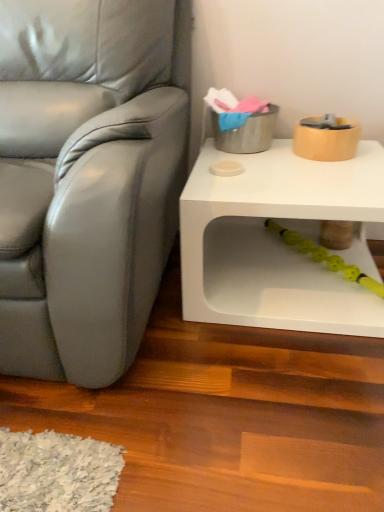
Question: Considering the positions of satin gray leather chair at left and yellow rubber toy at lower center in the image, is satin gray leather chair at left taller or shorter than yellow rubber toy at lower center?

Choices:
 (A) short
 (B) tall

Answer: (B)

Question: From a real-world perspective, relative to yellow rubber toy at lower center, is satin gray leather chair at left vertically above or below?

Choices:
 (A) above
 (B) below

Answer: (A)

Question: Estimate the real-world distances between objects in this image. Which object is farther from the white matte table at lower right?

Choices:
 (A) yellow rubber toy at lower center
 (B) satin gray leather chair at left

Answer: (B)

Question: Which object is the closest to the yellow rubber toy at lower center?

Choices:
 (A) satin gray leather chair at left
 (B) white matte table at lower right

Answer: (B)